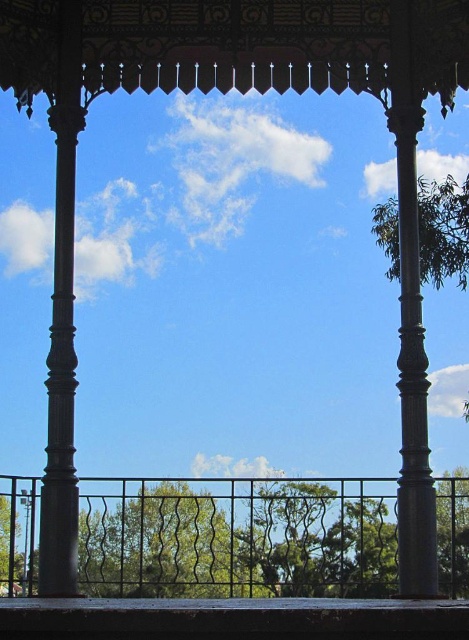
Does point (120, 579) lie in front of point (29, 513)?

Yes, point (120, 579) is in front of point (29, 513).

Find the location of a particular element. green leafy tree at center is located at coordinates (237, 536).